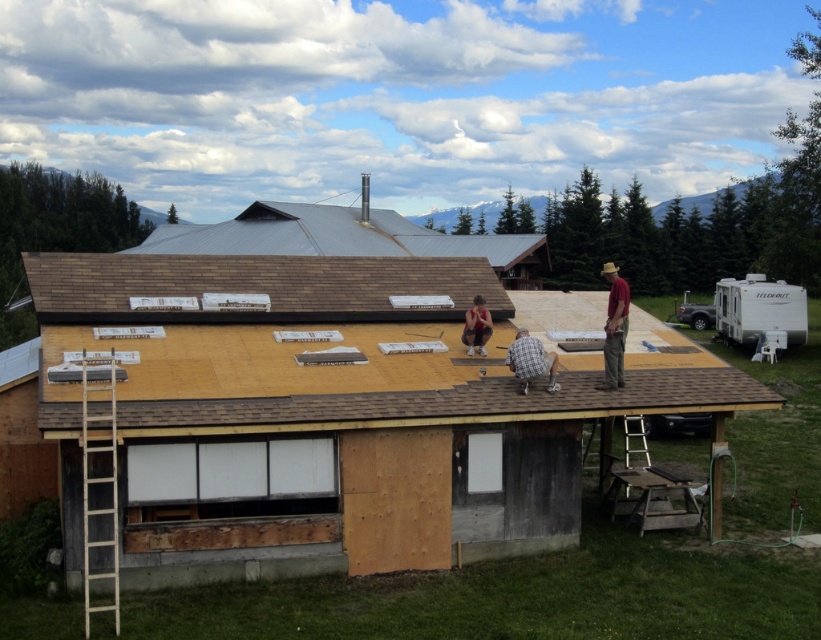
Question: Which of the following is the closest to the observer?

Choices:
 (A) (535, 346)
 (B) (612, 301)

Answer: (A)

Question: Which of the following is the farthest from the observer?

Choices:
 (A) (480, 310)
 (B) (109, 464)

Answer: (A)

Question: Where is metallic gray roof at upper center located in relation to red cotton shirt at center in the image?

Choices:
 (A) below
 (B) above

Answer: (B)

Question: Does metallic gray roof at upper center appear on the right side of matte black shorts at center?

Choices:
 (A) yes
 (B) no

Answer: (B)

Question: Does brown shingles at upper center have a greater width compared to metallic gray roof at upper center?

Choices:
 (A) yes
 (B) no

Answer: (B)

Question: Which object appears closest to the camera in this image?

Choices:
 (A) plaid fabric shirt at center
 (B) red cotton shirt at center
 (C) metallic gray roof at upper center
 (D) wooden ladder at left

Answer: (D)